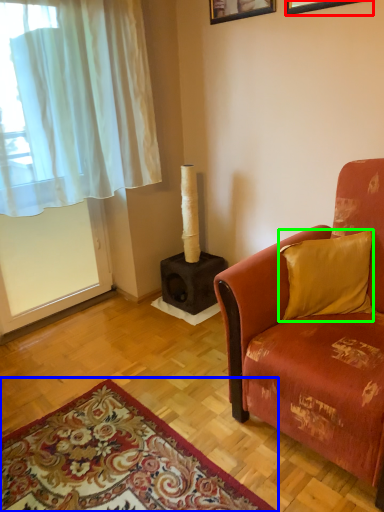
Question: Considering the real-world distances, which object is closest to picture frame (highlighted by a red box)? mat (highlighted by a blue box) or pillow (highlighted by a green box).

Choices:
 (A) mat
 (B) pillow

Answer: (B)